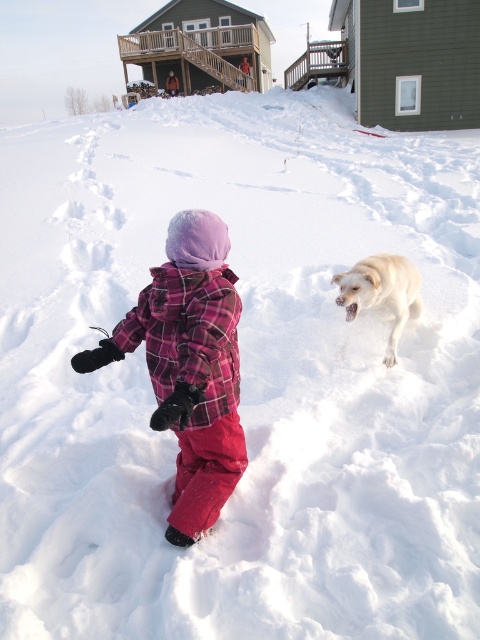
You are standing in the snowy scene and want to take a photo of the two points shown in the image. Which point, point (x=202, y=531) or point (x=368, y=305), will appear larger in your photo?

Point (x=202, y=531) will appear larger in the photo because it is closer to the camera than point (x=368, y=305).

You are standing at the point marked as point [203,440] in the snowy scene. You want to throw a snowball to the dog that is 2.5 meters away from you. Can you reach the dog with your snowball?

The distance between you and the dog is 2.5 meters, which is less than the 2.62 meters between you and the point, so yes, you can reach the dog with your snowball.

You are a photographer trying to capture a photo of the plaid fleece snowsuit at center and the light yellow fur at center. Since you want to ensure both subjects are in focus, which one should you focus on first to account for their height difference?

The plaid fleece snowsuit at center is taller than the light yellow fur at center, so you should focus on the plaid fleece snowsuit at center first to ensure both are in focus.